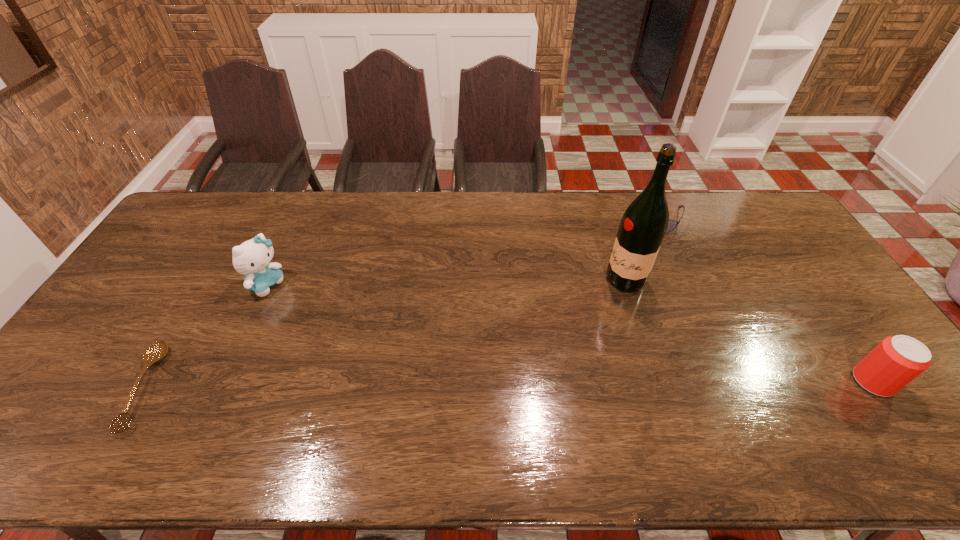
The width and height of the screenshot is (960, 540). I want to click on free space on the desktop that is between the ladle and the third shortest object and is positioned on the front-facing side of the tallest object, so click(466, 384).

Where is `free spot on the desktop that is between the ladle and the beer can and is positioned on the face of the fourth object from right to left`? free spot on the desktop that is between the ladle and the beer can and is positioned on the face of the fourth object from right to left is located at coordinates (444, 384).

In order to click on free space on the desktop that is between the ladle and the rightmost object and is positioned on the lenses of the farthest object in this screenshot , I will do `click(561, 384)`.